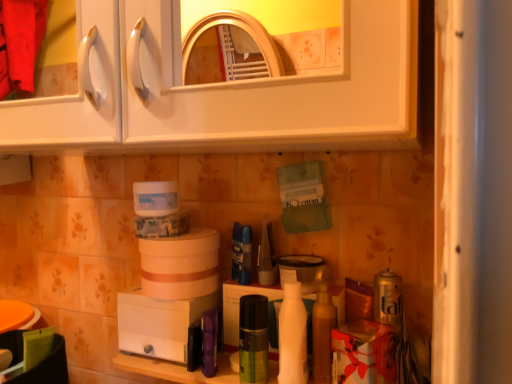
Question: Is silver metallic can at lower right, which ranks as the 5th toiletry in left-to-right order, placed right next to matte plastic container at center, positioned as the third toiletry in right-to-left order?

Choices:
 (A) no
 (B) yes

Answer: (A)

Question: From a real-world perspective, is silver metallic can at lower right, which ranks as the 5th toiletry in left-to-right order, on top of matte plastic container at center, acting as the third toiletry starting from the left?

Choices:
 (A) yes
 (B) no

Answer: (B)

Question: Is matte plastic container at center, acting as the third toiletry starting from the left, at the back of silver metallic can at lower right, which ranks as the 5th toiletry in left-to-right order?

Choices:
 (A) no
 (B) yes

Answer: (A)

Question: Is silver metallic can at lower right, which ranks as the 5th toiletry in left-to-right order, not close to matte plastic container at center, positioned as the third toiletry in right-to-left order?

Choices:
 (A) no
 (B) yes

Answer: (A)

Question: Can you confirm if silver metallic can at lower right, which ranks as the 5th toiletry in left-to-right order, is smaller than matte plastic container at center, acting as the third toiletry starting from the left?

Choices:
 (A) yes
 (B) no

Answer: (B)

Question: Can you confirm if silver metallic can at lower right, which ranks as the 5th toiletry in left-to-right order, is bigger than matte plastic container at center, acting as the third toiletry starting from the left?

Choices:
 (A) yes
 (B) no

Answer: (A)

Question: Is white glossy cabinet at upper center aimed at matte plastic container at center, positioned as the third toiletry in right-to-left order?

Choices:
 (A) no
 (B) yes

Answer: (A)

Question: From a real-world perspective, is white glossy cabinet at upper center positioned under matte plastic container at center, positioned as the third toiletry in right-to-left order, based on gravity?

Choices:
 (A) no
 (B) yes

Answer: (A)

Question: Would you consider white glossy cabinet at upper center to be distant from matte plastic container at center, acting as the third toiletry starting from the left?

Choices:
 (A) yes
 (B) no

Answer: (B)

Question: Is white glossy cabinet at upper center to the right of matte plastic container at center, acting as the third toiletry starting from the left, from the viewer's perspective?

Choices:
 (A) yes
 (B) no

Answer: (B)

Question: Can you confirm if white glossy cabinet at upper center is taller than matte plastic container at center, positioned as the third toiletry in right-to-left order?

Choices:
 (A) no
 (B) yes

Answer: (B)

Question: Does white glossy cabinet at upper center have a greater width compared to matte plastic container at center, acting as the third toiletry starting from the left?

Choices:
 (A) yes
 (B) no

Answer: (A)

Question: From the image's perspective, does shiny gold lotion at center, the 4th toiletry in the left-to-right sequence, appear higher than matte plastic container at center, acting as the third toiletry starting from the left?

Choices:
 (A) yes
 (B) no

Answer: (B)